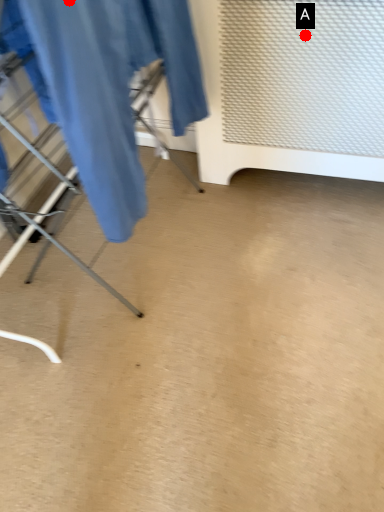
Question: Two points are circled on the image, labeled by A and B beside each circle. Which point is farther from the camera taking this photo?

Choices:
 (A) A is further
 (B) B is further

Answer: (A)